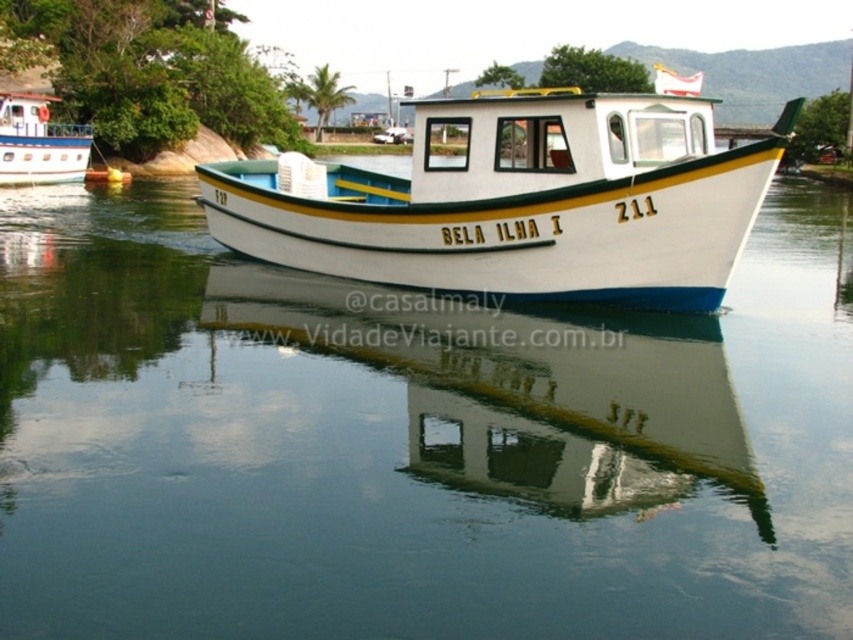
You are a photographer trying to capture the reflection of the white glossy boat at center in the smooth water at center. Based on the scene description, can you confirm if the boat is positioned above the water where its reflection would naturally appear?

Yes, the white glossy boat at center is above the smooth water at center, so its reflection should be visible on the water surface.

You are standing on the deck of the fishing boat BELA ILHA I and want to reach the two points marked in the image. Which point is closer to you, point (612, 602) or point (49, 176)?

Point (612, 602) is closer to you than point (49, 176) because it is closer to the camera.